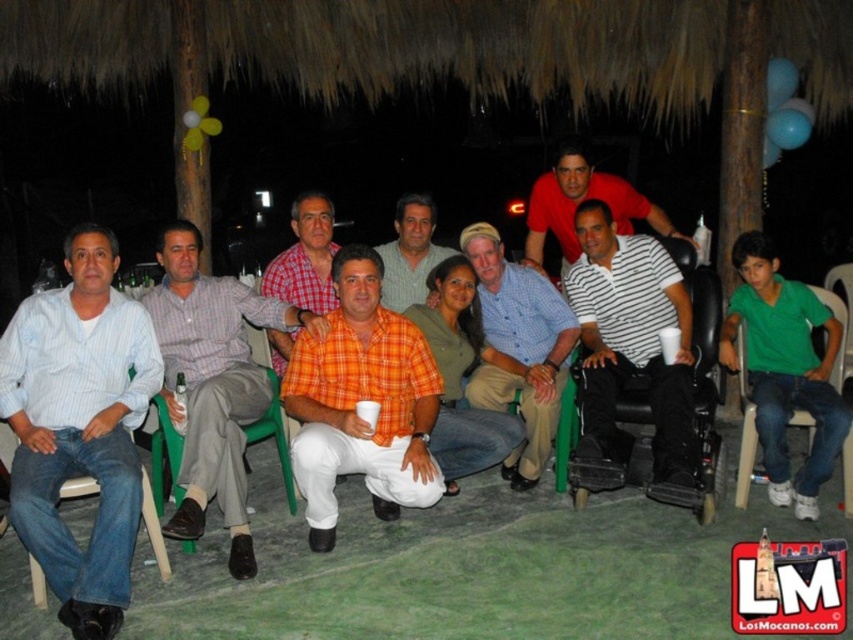
Who is lower down, striped cotton shirt at center or matte red shirt at center?

striped cotton shirt at center is lower down.

Does striped cotton shirt at center have a greater width compared to matte red shirt at center?

Yes, striped cotton shirt at center is wider than matte red shirt at center.

Between point (181, 317) and point (601, 173), which one is positioned in front?

Point (181, 317) is in front.

The image size is (853, 640). Identify the location of striped cotton shirt at center. (213, 381).

Does striped cotton shirt at center appear on the left side of denim plastic chair at lower left?

No, striped cotton shirt at center is not to the left of denim plastic chair at lower left.

Describe the element at coordinates (213, 381) in the screenshot. I see `striped cotton shirt at center` at that location.

Between point (196, 484) and point (149, 534), which one is positioned in front?

Positioned in front is point (196, 484).

Locate an element on the screen. The height and width of the screenshot is (640, 853). striped cotton shirt at center is located at coordinates (213, 381).

Can you confirm if orange plaid shirt at center is taller than striped cotton shirt at center?

In fact, orange plaid shirt at center may be shorter than striped cotton shirt at center.

Is point (349, 333) in front of point (270, 314)?

Yes, point (349, 333) is in front of point (270, 314).

Between point (328, 353) and point (190, 253), which one is positioned in front?

Point (328, 353) is in front.

What are the coordinates of `orange plaid shirt at center` in the screenshot? It's located at coord(363,400).